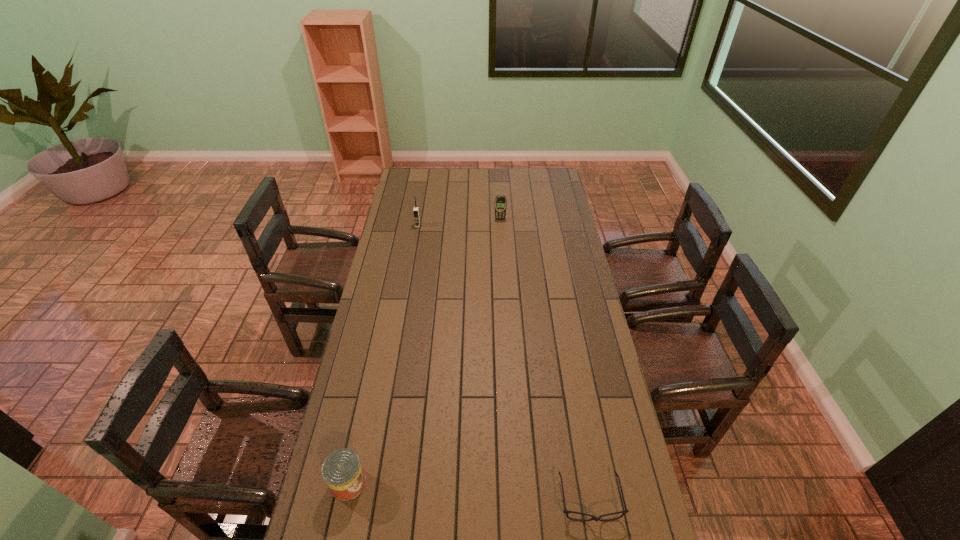
The image size is (960, 540). Find the location of `the left cellular telephone`. the left cellular telephone is located at coordinates (416, 209).

At what (x,y) coordinates should I click in order to perform the action: click on the tallest object. Please return your answer as a coordinate pair (x, y). The height and width of the screenshot is (540, 960). Looking at the image, I should click on (416, 209).

Image resolution: width=960 pixels, height=540 pixels. Identify the location of the second tallest object. (500, 201).

At what (x,y) coordinates should I click in order to perform the action: click on the farthest object. Please return your answer as a coordinate pair (x, y). The height and width of the screenshot is (540, 960). Looking at the image, I should click on (500, 201).

Find the location of a particular element. The width and height of the screenshot is (960, 540). the third tallest object is located at coordinates (x=342, y=471).

Find the location of `the leftmost object`. the leftmost object is located at coordinates (342, 471).

Find the location of a particular element. The width and height of the screenshot is (960, 540). the rightmost object is located at coordinates (625, 511).

This screenshot has height=540, width=960. I want to click on spectacles, so click(x=625, y=511).

You are a GUI agent. You are given a task and a screenshot of the screen. Output one action in this format:
    pyautogui.click(x=<x>, y=<y>)
    Task: Click on the vacant area located on the front-facing side of the second farthest object
    The width and height of the screenshot is (960, 540).
    Given the screenshot: What is the action you would take?
    pyautogui.click(x=410, y=268)

This screenshot has width=960, height=540. What are the coordinates of `vacant space situated 0.100m on the screen of the second tallest object` in the screenshot? It's located at (501, 232).